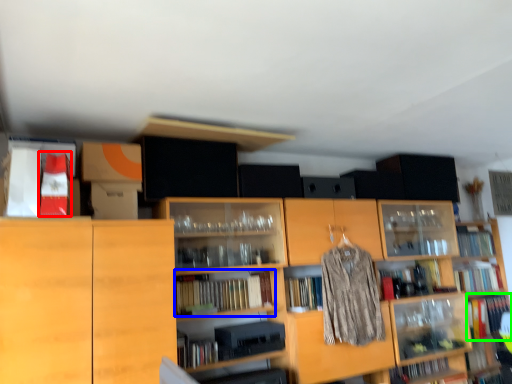
Question: Considering the real-world distances, which object is closest to book (highlighted by a red box)? book (highlighted by a blue box) or book (highlighted by a green box).

Choices:
 (A) book
 (B) book

Answer: (A)